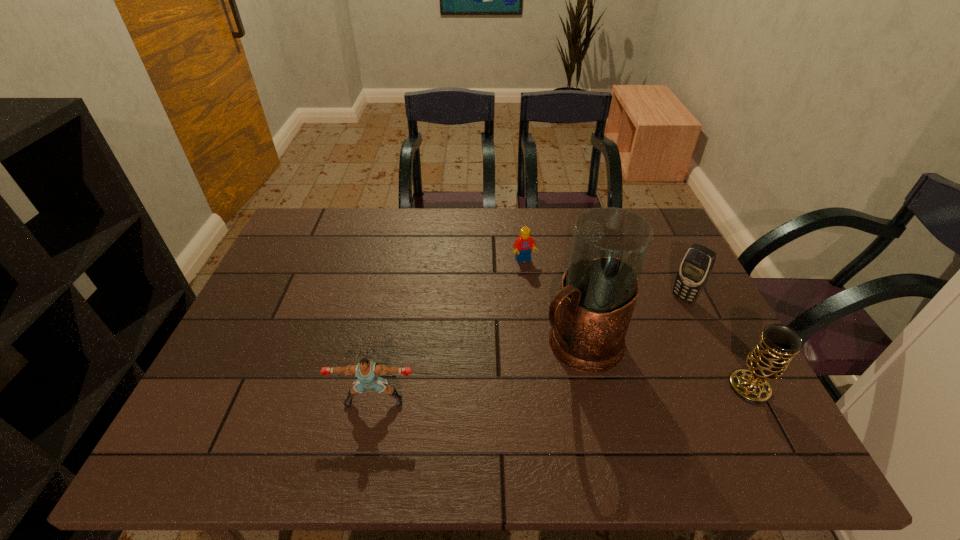
Locate an element on the screen. vacant area located 0.080m on the face of the farthest object is located at coordinates (536, 284).

The image size is (960, 540). I want to click on free space located 0.080m on the front face of the cellular telephone, so click(662, 319).

Image resolution: width=960 pixels, height=540 pixels. I want to click on vacant space situated on the front face of the cellular telephone, so click(631, 349).

The width and height of the screenshot is (960, 540). In order to click on free space located 0.320m on the front face of the cellular telephone in this screenshot , I will do `click(610, 369)`.

Image resolution: width=960 pixels, height=540 pixels. What are the coordinates of `vacant space located 0.050m with the handle on the side of the tallest object` in the screenshot? It's located at [535, 376].

You are a GUI agent. You are given a task and a screenshot of the screen. Output one action in this format:
    pyautogui.click(x=<x>, y=<y>)
    Task: Click on the vacant space located 0.170m with the handle on the side of the tallest object
    
    Given the screenshot: What is the action you would take?
    pyautogui.click(x=496, y=406)

The width and height of the screenshot is (960, 540). What are the coordinates of `free space located 0.150m with the handle on the side of the tallest object` in the screenshot? It's located at (503, 401).

Where is `puncher located at the near edge`? puncher located at the near edge is located at coordinates (366, 371).

Identify the location of chalice present at the near edge. (768, 360).

Where is `chalice located at the right edge`? chalice located at the right edge is located at coordinates (768, 360).